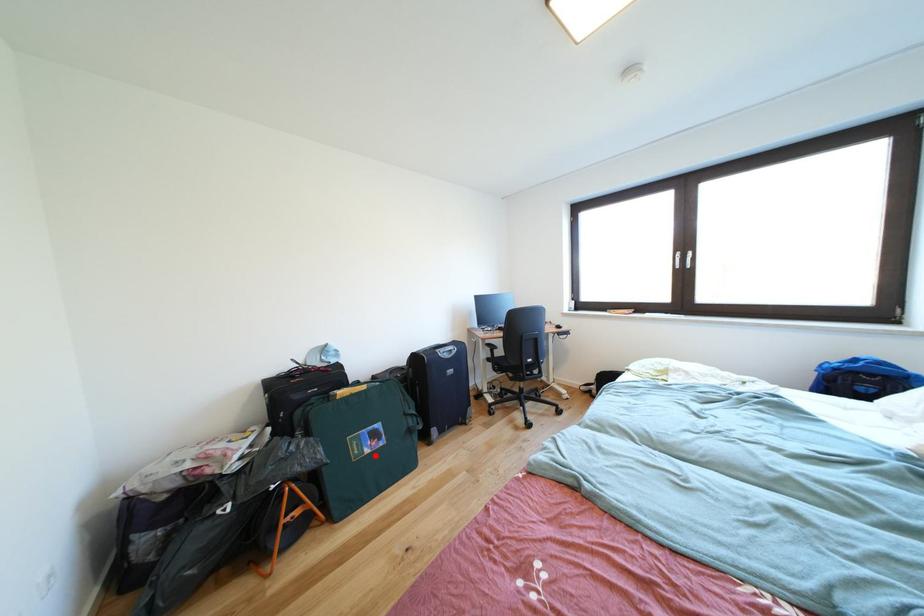
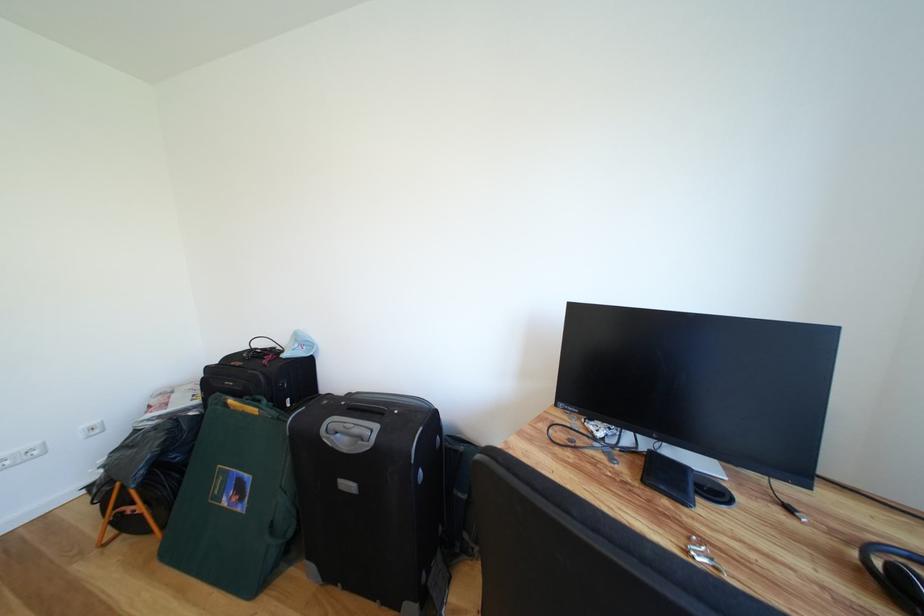
In the second image, find the point that corresponds to the highlighted location in the first image.

(234, 506)